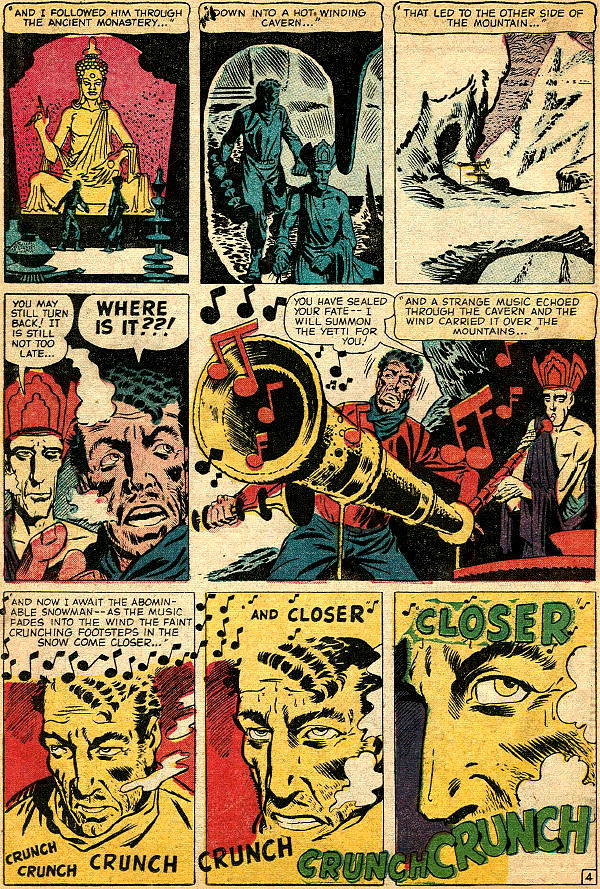
Identify the location of golden buddah statue. The height and width of the screenshot is (889, 600). (89, 139).